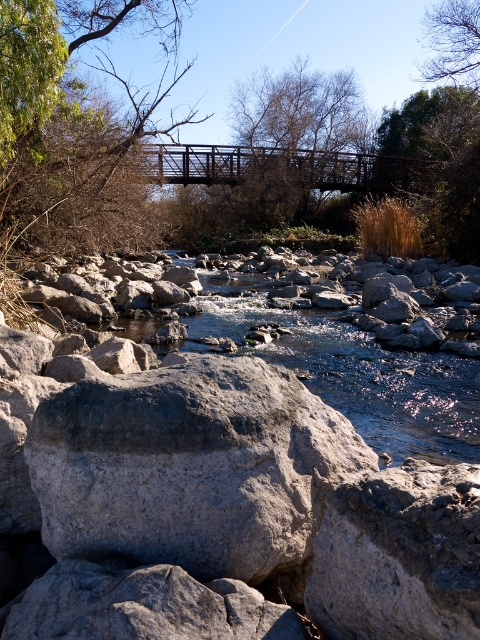
You are standing at the wooden bridge and want to reach the point marked as point [181,432]. Which direction should you move relative to the other point point [436,61]?

You should move towards the point [181,432] which is in front of point [436,61].

Looking at the scene, which tree is positioned to the left when comparing the brown leafy tree at upper center and the green leafy tree at upper right?

The brown leafy tree at upper center is positioned to the left of the green leafy tree at upper right.